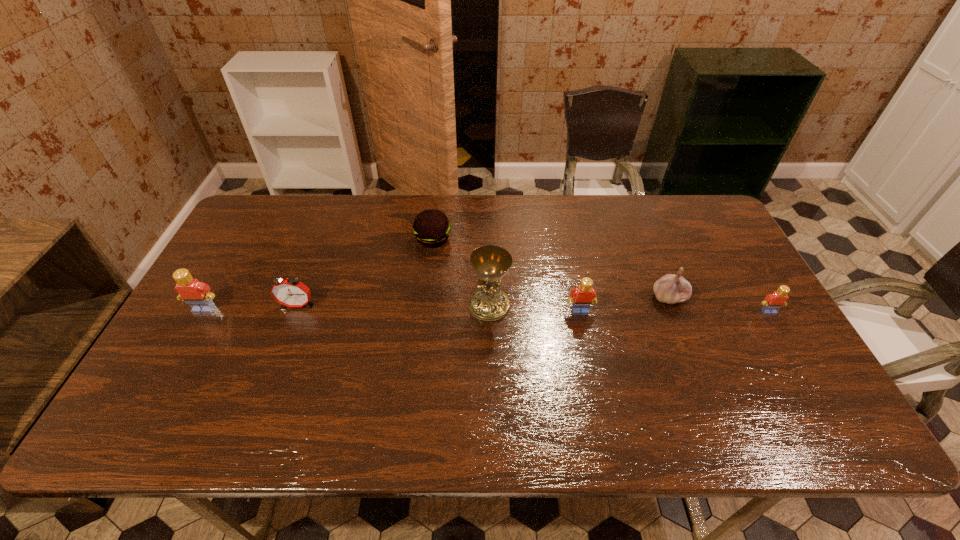
Locate an element on the screen. The height and width of the screenshot is (540, 960). free space between the alarm clock and the shortest Lego is located at coordinates (533, 308).

The height and width of the screenshot is (540, 960). What are the coordinates of `free space that is in between the fourth object from left to right and the second Lego from right to left` in the screenshot? It's located at (535, 308).

Find the location of a particular element. free space between the patty and the garlic is located at coordinates coord(551,268).

At what (x,y) coordinates should I click in order to perform the action: click on free space between the third object from right to left and the second object from right to left. Please return your answer as a coordinate pair (x, y). This screenshot has width=960, height=540. Looking at the image, I should click on (625, 304).

At what (x,y) coordinates should I click in order to perform the action: click on empty space that is in between the fourth object from right to left and the second object from left to right. Please return your answer as a coordinate pair (x, y). This screenshot has width=960, height=540. Looking at the image, I should click on (394, 305).

This screenshot has width=960, height=540. What are the coordinates of `the second closest object to the alarm clock` in the screenshot? It's located at (431, 228).

Select which object is the fifth closest to the second shortest Lego. Please provide its 2D coordinates. Your answer should be formatted as a tuple, i.e. [(x, y)], where the tuple contains the x and y coordinates of a point satisfying the conditions above.

[(291, 292)]

Where is `Lego that is the third closest to the second object from right to left`? The width and height of the screenshot is (960, 540). Lego that is the third closest to the second object from right to left is located at coordinates (197, 294).

Find the location of a particular element. Lego that stands as the second closest to the second tallest Lego is located at coordinates (197, 294).